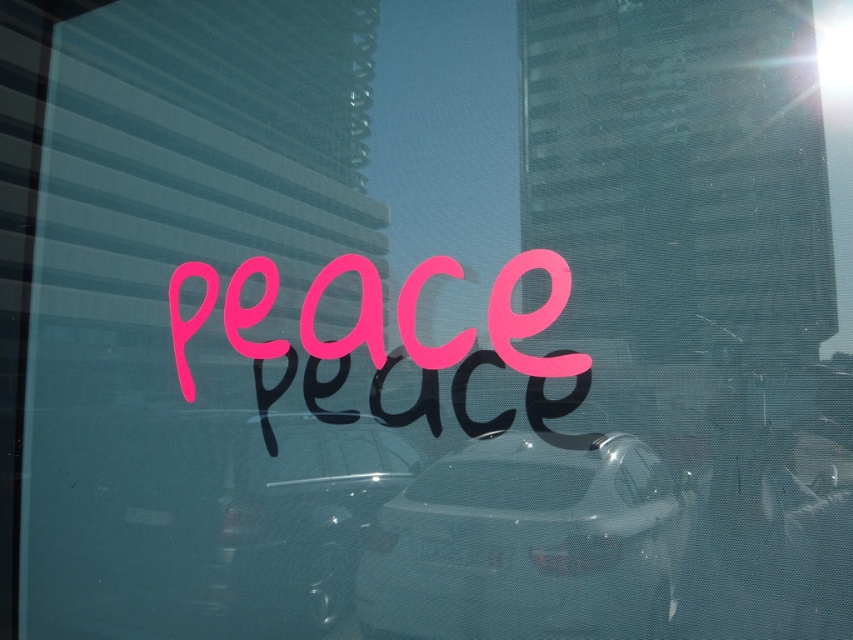
Question: Is the position of satin silver car at center more distant than that of metallic silver car at center?

Choices:
 (A) no
 (B) yes

Answer: (A)

Question: Among these points, which one is nearest to the camera?

Choices:
 (A) (515, 321)
 (B) (561, 465)
 (C) (375, 465)

Answer: (B)

Question: Considering the relative positions of satin silver car at center and metallic silver car at center in the image provided, where is satin silver car at center located with respect to metallic silver car at center?

Choices:
 (A) above
 (B) below

Answer: (B)

Question: Observing the image, what is the correct spatial positioning of metallic silver car at center in reference to pink matte text at center?

Choices:
 (A) right
 (B) left

Answer: (B)

Question: Which point is closer to the camera?

Choices:
 (A) metallic silver car at center
 (B) pink matte text at center
 (C) satin silver car at center

Answer: (C)

Question: Which point appears closest to the camera in this image?

Choices:
 (A) (268, 436)
 (B) (517, 433)
 (C) (268, 300)

Answer: (B)